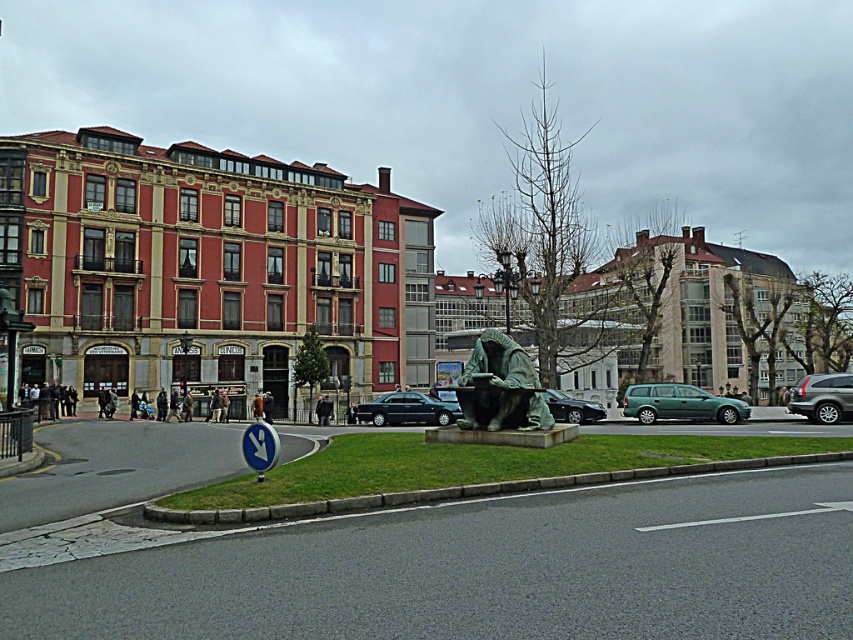
Question: Which point appears closest to the camera in this image?

Choices:
 (A) (505, 376)
 (B) (753, 490)
 (C) (815, 404)

Answer: (B)

Question: Is green matte van at center above silver metallic suv at center?

Choices:
 (A) no
 (B) yes

Answer: (A)

Question: Which point is closer to the camera?

Choices:
 (A) shiny black sedan at center
 (B) green stone statue at center

Answer: (B)

Question: Can you confirm if green stone statue at center is bigger than green patina statue at center?

Choices:
 (A) yes
 (B) no

Answer: (A)

Question: Which is nearer to the green matte van at center?

Choices:
 (A) green stone statue at center
 (B) silver metallic suv at center
 (C) shiny black sedan at center
 (D) green metallic car at center

Answer: (B)

Question: Does shiny black sedan at center have a smaller size compared to silver metallic suv at center?

Choices:
 (A) no
 (B) yes

Answer: (A)